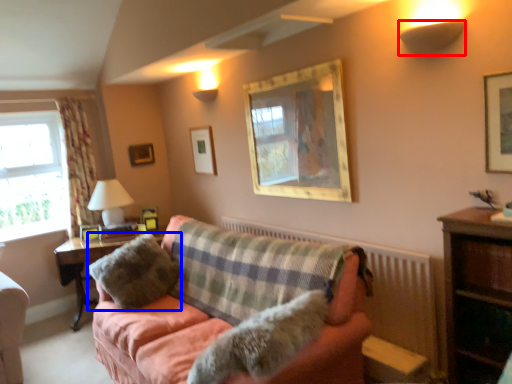
Question: Among these objects, which one is nearest to the camera, lamp (highlighted by a red box) or pillow (highlighted by a blue box)?

Choices:
 (A) lamp
 (B) pillow

Answer: (A)